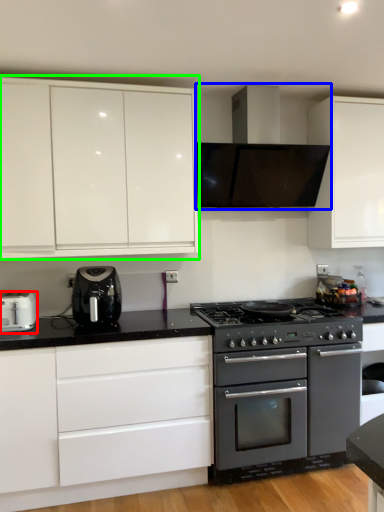
Question: Based on their relative distances, which object is farther from toaster (highlighted by a red box)? Choose from home appliance (highlighted by a blue box) and cabinetry (highlighted by a green box).

Choices:
 (A) home appliance
 (B) cabinetry

Answer: (A)